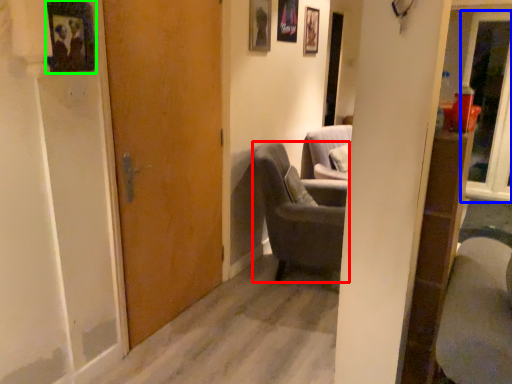
Question: Considering the real-world distances, which object is farthest from chair (highlighted by a red box)? glass door (highlighted by a blue box) or picture frame (highlighted by a green box)?

Choices:
 (A) glass door
 (B) picture frame

Answer: (A)